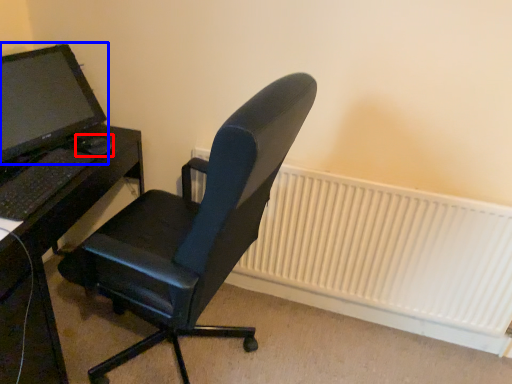
Question: Which of the following is the closest to the observer, mouse (highlighted by a red box) or computer monitor (highlighted by a blue box)?

Choices:
 (A) mouse
 (B) computer monitor

Answer: (B)